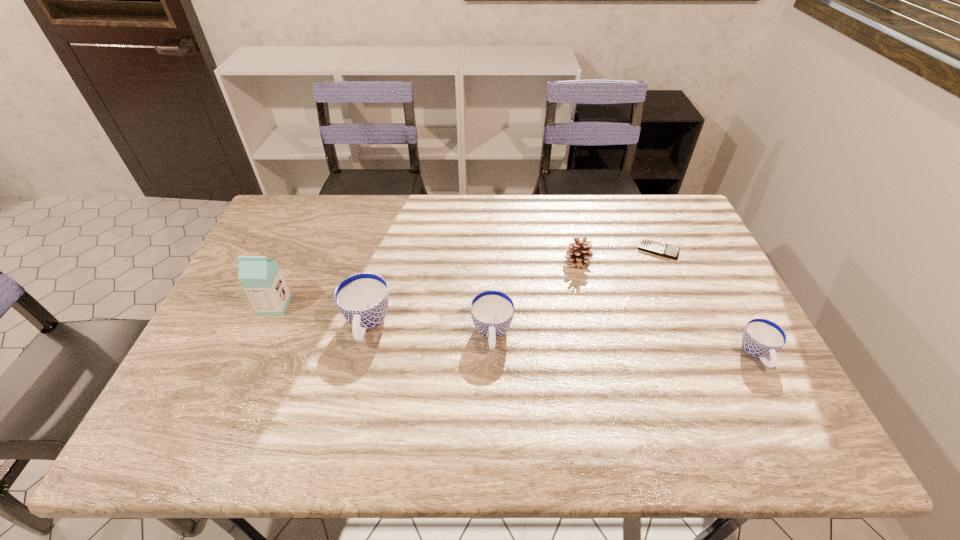
If the aim is uniform spacing by inserting an additional cup among them, please point to a vacant space for this new cup. Please provide its 2D coordinates. Your answer should be formatted as a tuple, i.e. [(x, y)], where the tuple contains the x and y coordinates of a point satisfying the conditions above.

[(622, 344)]